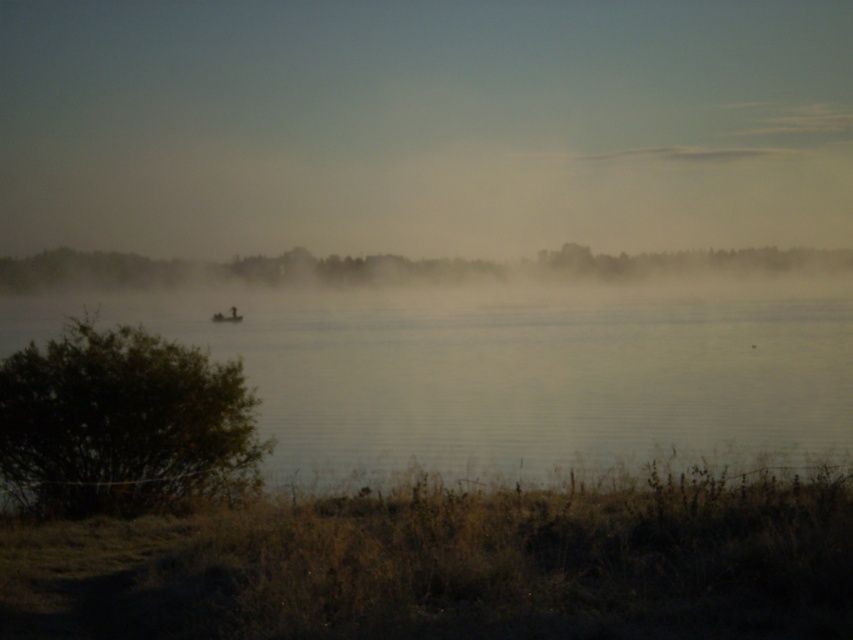
From the picture: Does clear water at center lie behind green leafy tree at center?

No, it is not.

Find the location of a particular element. This screenshot has height=640, width=853. clear water at center is located at coordinates (512, 369).

Between green leafy bush at lower left and green leafy tree at center, which one appears on the left side from the viewer's perspective?

green leafy bush at lower left is more to the left.

Which is below, green leafy bush at lower left or green leafy tree at center?

Positioned lower is green leafy bush at lower left.

Between point (138, 387) and point (627, 268), which one is positioned behind?

Point (627, 268)

This screenshot has width=853, height=640. Find the location of `green leafy bush at lower left`. green leafy bush at lower left is located at coordinates (122, 422).

Who is taller, clear water at center or green leafy bush at lower left?

With more height is clear water at center.

Does clear water at center have a lesser width compared to green leafy bush at lower left?

In fact, clear water at center might be wider than green leafy bush at lower left.

Is point (338, 392) in front of point (3, 381)?

No, it is not.

Identify the location of clear water at center. (512, 369).